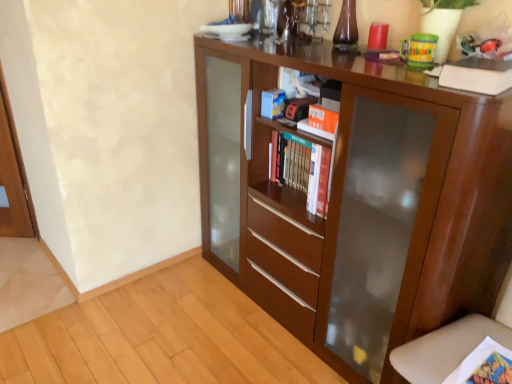
Question: From a real-world perspective, is white matte book at upper right on top of brown wood cupboard at center?

Choices:
 (A) no
 (B) yes

Answer: (B)

Question: From the image's perspective, does white matte book at upper right appear higher than brown wood cupboard at center?

Choices:
 (A) no
 (B) yes

Answer: (B)

Question: Considering the relative sizes of white matte book at upper right and brown wood cupboard at center in the image provided, is white matte book at upper right thinner than brown wood cupboard at center?

Choices:
 (A) no
 (B) yes

Answer: (B)

Question: Is white matte book at upper right far from brown wood cupboard at center?

Choices:
 (A) no
 (B) yes

Answer: (A)

Question: Considering the relative sizes of white matte book at upper right and brown wood cupboard at center in the image provided, is white matte book at upper right taller than brown wood cupboard at center?

Choices:
 (A) yes
 (B) no

Answer: (B)

Question: Does white matte book at upper right lie behind brown wood cupboard at center?

Choices:
 (A) yes
 (B) no

Answer: (A)

Question: Can we say brown wood cupboard at center lies outside white matte book at upper right?

Choices:
 (A) no
 (B) yes

Answer: (B)

Question: From a real-world perspective, is brown wood cupboard at center beneath white matte book at upper right?

Choices:
 (A) no
 (B) yes

Answer: (B)

Question: Can you confirm if brown wood cupboard at center is bigger than white matte book at upper right?

Choices:
 (A) no
 (B) yes

Answer: (B)

Question: Is brown wood cupboard at center at the left side of white matte book at upper right?

Choices:
 (A) no
 (B) yes

Answer: (B)

Question: Is brown wood cupboard at center oriented away from white matte book at upper right?

Choices:
 (A) yes
 (B) no

Answer: (B)

Question: Can you confirm if brown wood cupboard at center is taller than white matte book at upper right?

Choices:
 (A) yes
 (B) no

Answer: (A)

Question: Does hardcover books at center appear on the left side of brown wood cupboard at center?

Choices:
 (A) no
 (B) yes

Answer: (B)